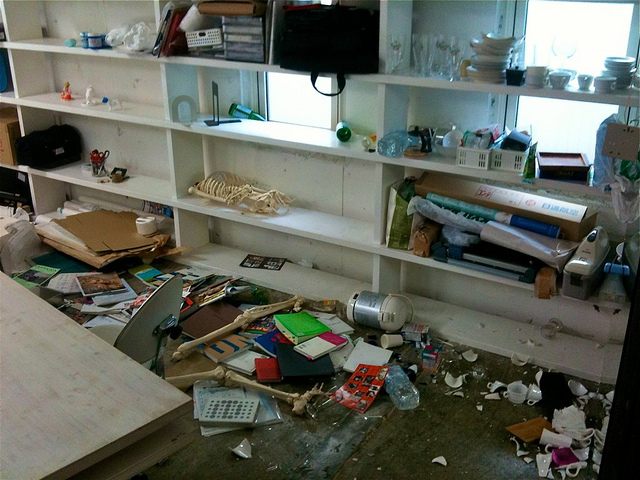
This screenshot has width=640, height=480. In order to click on random objects on left shelf in this screenshot , I will do `click(66, 89)`, `click(91, 91)`, `click(115, 98)`, `click(70, 39)`, `click(83, 39)`, `click(125, 39)`, `click(114, 175)`, `click(105, 169)`, `click(67, 163)`.